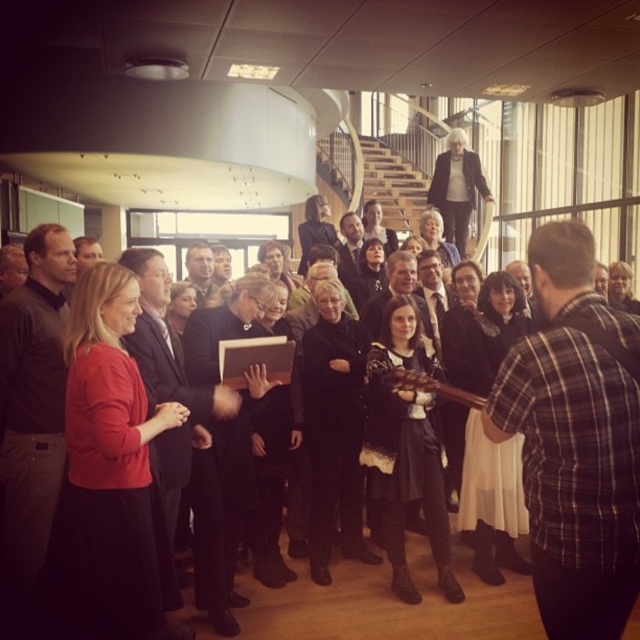
Between plaid cotton shirt at right and matte brown jacket at center, which one appears on the left side from the viewer's perspective?

From the viewer's perspective, matte brown jacket at center appears more on the left side.

Is the position of plaid cotton shirt at right less distant than that of matte brown jacket at center?

Yes, it is in front of matte brown jacket at center.

Is point (545, 280) closer to viewer compared to point (208, 280)?

Yes.

Where is `plaid cotton shirt at right`? plaid cotton shirt at right is located at coordinates (573, 442).

Between plaid cotton shirt at right and smooth black suit at center, which one appears on the right side from the viewer's perspective?

From the viewer's perspective, plaid cotton shirt at right appears more on the right side.

Describe the element at coordinates (573, 442) in the screenshot. I see `plaid cotton shirt at right` at that location.

Identify the location of plaid cotton shirt at right. (573, 442).

Can you confirm if plaid cotton shirt at right is thinner than dark gray shirt at left?

No.

Is plaid cotton shirt at right smaller than dark gray shirt at left?

Correct, plaid cotton shirt at right occupies less space than dark gray shirt at left.

Is point (637, 560) closer to camera compared to point (29, 384)?

Yes, point (637, 560) is closer to viewer.

At what (x,y) coordinates should I click in order to perform the action: click on plaid cotton shirt at right. Please return your answer as a coordinate pair (x, y). Image resolution: width=640 pixels, height=640 pixels. Looking at the image, I should click on (573, 442).